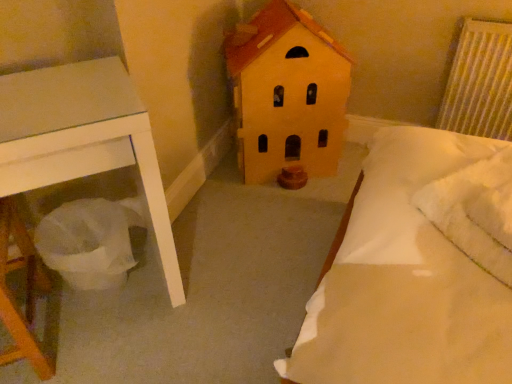
Question: Based on their sizes in the image, would you say matte yellow house at center is bigger or smaller than white textured radiator at upper right?

Choices:
 (A) big
 (B) small

Answer: (A)

Question: Visually, is matte yellow house at center positioned to the left or to the right of white textured radiator at upper right?

Choices:
 (A) right
 (B) left

Answer: (B)

Question: Which object is the closest to the white fluffy pillow at upper right?

Choices:
 (A) matte yellow house at center
 (B) white textured radiator at upper right

Answer: (A)

Question: Which object is positioned closest to the white textured radiator at upper right?

Choices:
 (A) white fluffy pillow at upper right
 (B) matte yellow house at center

Answer: (B)